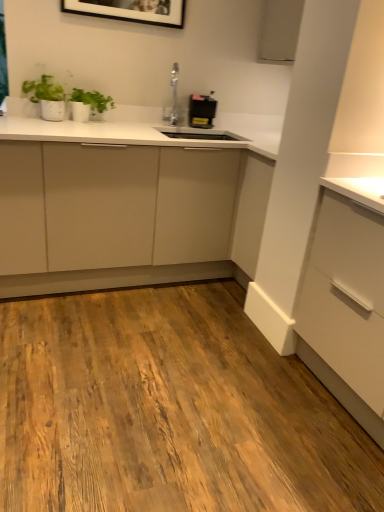
Question: Is green matte plant at upper left wider than black plastic toaster at upper center?

Choices:
 (A) no
 (B) yes

Answer: (B)

Question: Considering the relative sizes of green matte plant at upper left and black plastic toaster at upper center in the image provided, is green matte plant at upper left bigger than black plastic toaster at upper center?

Choices:
 (A) yes
 (B) no

Answer: (A)

Question: Considering the relative sizes of green matte plant at upper left and black plastic toaster at upper center in the image provided, is green matte plant at upper left taller than black plastic toaster at upper center?

Choices:
 (A) no
 (B) yes

Answer: (A)

Question: From a real-world perspective, is green matte plant at upper left beneath black plastic toaster at upper center?

Choices:
 (A) yes
 (B) no

Answer: (A)

Question: Considering the relative sizes of green matte plant at upper left and black plastic toaster at upper center in the image provided, is green matte plant at upper left smaller than black plastic toaster at upper center?

Choices:
 (A) yes
 (B) no

Answer: (B)

Question: Does green matte plant at upper left appear on the left side of black plastic toaster at upper center?

Choices:
 (A) yes
 (B) no

Answer: (A)

Question: From a real-world perspective, does matte white cabinet at center stand above green matte plant at upper left?

Choices:
 (A) yes
 (B) no

Answer: (B)

Question: Is matte white cabinet at center looking in the opposite direction of green matte plant at upper left?

Choices:
 (A) yes
 (B) no

Answer: (B)

Question: Considering the relative sizes of matte white cabinet at center and green matte plant at upper left in the image provided, is matte white cabinet at center bigger than green matte plant at upper left?

Choices:
 (A) no
 (B) yes

Answer: (B)

Question: From the image's perspective, is matte white cabinet at center located above green matte plant at upper left?

Choices:
 (A) yes
 (B) no

Answer: (B)

Question: Is matte white cabinet at center further to camera compared to green matte plant at upper left?

Choices:
 (A) no
 (B) yes

Answer: (A)

Question: From a real-world perspective, is matte white cabinet at center beneath green matte plant at upper left?

Choices:
 (A) no
 (B) yes

Answer: (B)

Question: Is black plastic toaster at upper center bigger than matte white cabinet at center?

Choices:
 (A) yes
 (B) no

Answer: (B)